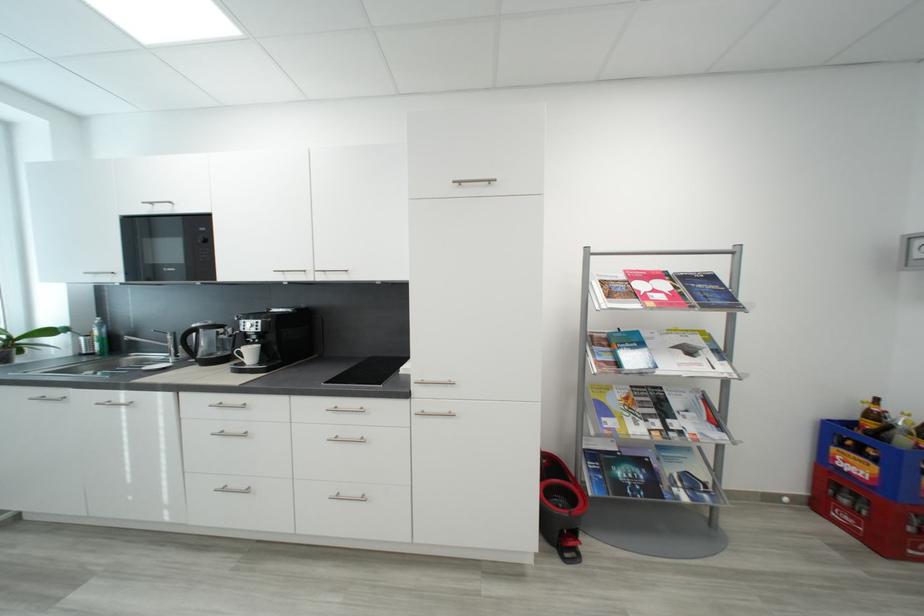
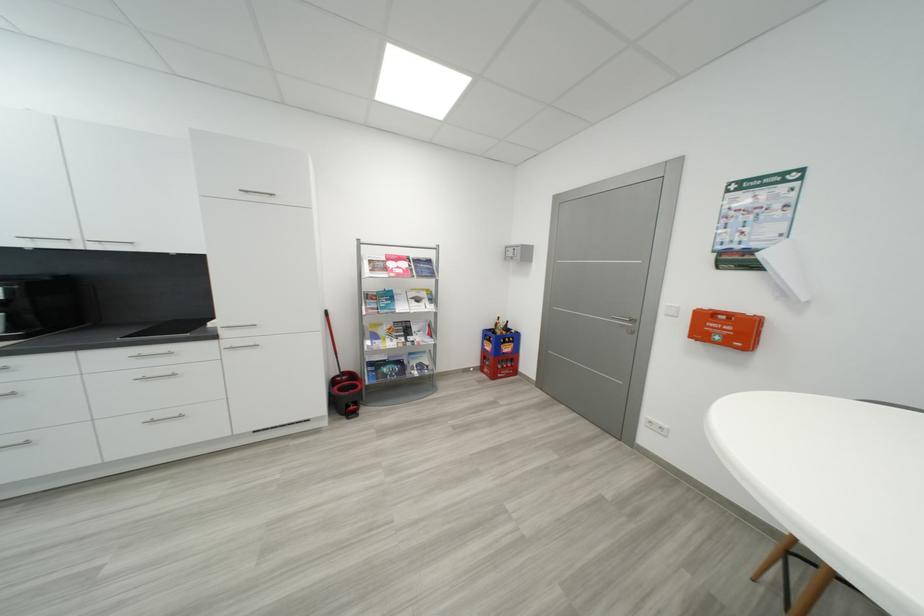
The point at [684,406] is marked in the first image. Where is the corresponding point in the second image?

(421, 330)